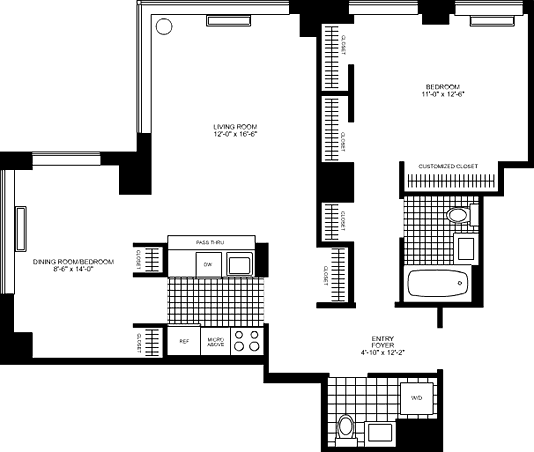
Find the location of a particular element. This screenshot has width=534, height=452. toilet is located at coordinates (343, 434), (456, 215).